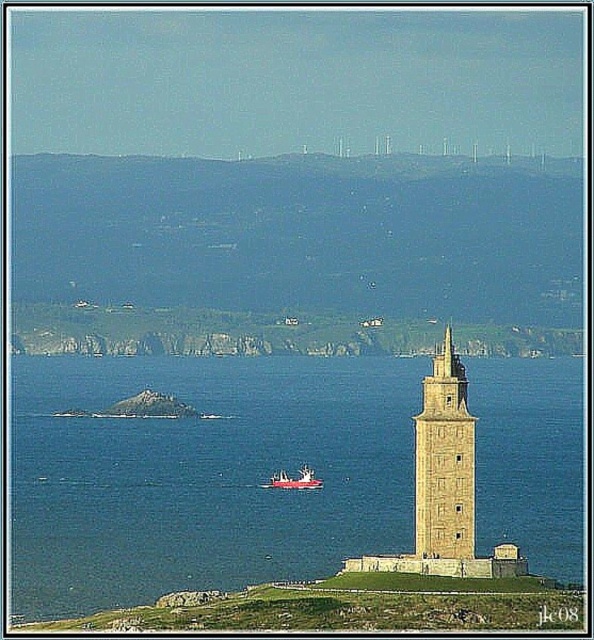
Question: Where is beige stone tower at center located in relation to red plastic boat at center in the image?

Choices:
 (A) left
 (B) right

Answer: (B)

Question: Which of the following is the farthest from the observer?

Choices:
 (A) blue water at center
 (B) red plastic boat at center

Answer: (B)

Question: Can you confirm if blue water at center is positioned to the right of beige stone tower at center?

Choices:
 (A) no
 (B) yes

Answer: (A)

Question: Does blue water at center appear on the left side of beige stone tower at center?

Choices:
 (A) no
 (B) yes

Answer: (B)

Question: Which point is closer to the camera?

Choices:
 (A) (466, 385)
 (B) (285, 483)
 (C) (507, 515)

Answer: (B)

Question: Which object is positioned closest to the beige stone tower at center?

Choices:
 (A) red plastic boat at center
 (B) blue water at center

Answer: (B)